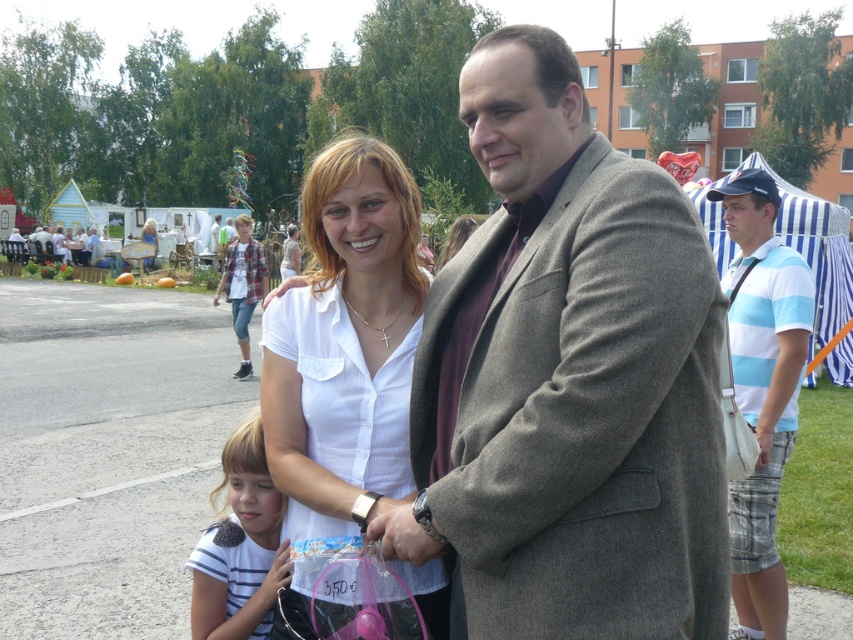
What object is located at the coordinates point (345, 346) in the image?

The point (345, 346) indicates the white smooth shirt at center.

From the picture: You are a photographer at the event and want to take a photo of both the white striped shirt at center and the white glossy shirt at center. However, you notice that one is blocking the other. Which shirt is currently obscuring the other?

The white striped shirt at center is in front of the white glossy shirt at center, so it is obscuring the white glossy shirt at center.